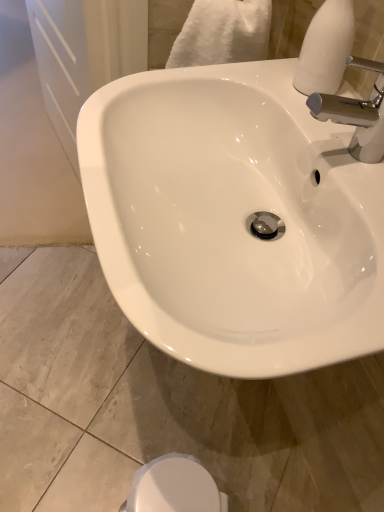
The width and height of the screenshot is (384, 512). I want to click on vacant space that is to the left of white glossy bidet at lower center, so click(x=93, y=466).